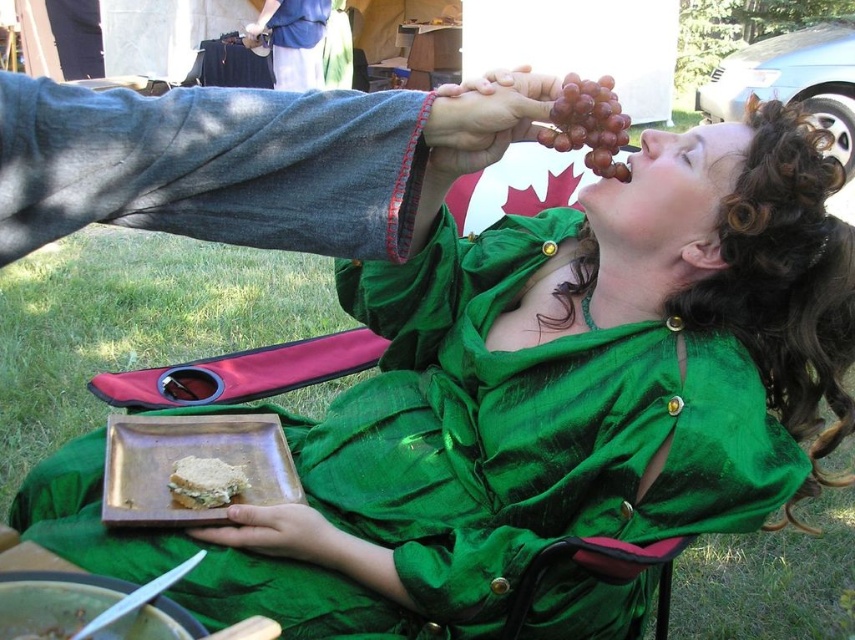
What object is located at the coordinate point [588,124] in the image?

The ripe purple grapes at upper center are located at the coordinate point [588,124].

You are standing at the origin of the coordinate system in the image. There are two points marked in the scene. The first point is at position point (599,152) and the second is at point (172,468). If you want to move towards the point that is closer to you, which point should you head towards?

Point (599,152) is in front of point (172,468), so you should head towards point (599,152) since it is closer to you.